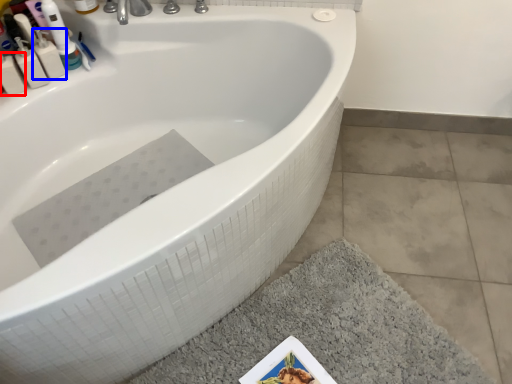
Question: Which of the following is the farthest to the observer, mouthwash (highlighted by a red box) or mouthwash (highlighted by a blue box)?

Choices:
 (A) mouthwash
 (B) mouthwash

Answer: (B)